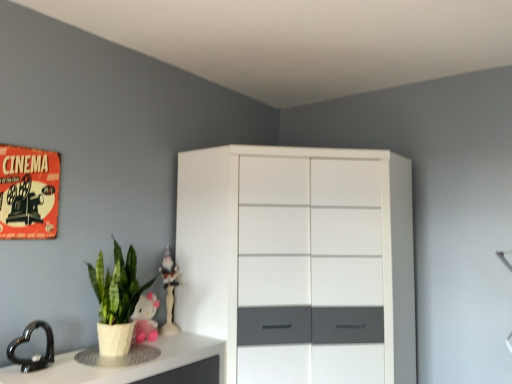
Question: Is pink plush toy at lower left, the 2th toy viewed from the back, bigger than white glossy counter top at lower left?

Choices:
 (A) no
 (B) yes

Answer: (A)

Question: From a real-world perspective, is pink plush toy at lower left, marked as the 1th toy in a front-to-back arrangement, on top of white glossy counter top at lower left?

Choices:
 (A) yes
 (B) no

Answer: (A)

Question: Is pink plush toy at lower left, the 2th toy viewed from the back, closer to camera compared to white glossy counter top at lower left?

Choices:
 (A) yes
 (B) no

Answer: (B)

Question: Does pink plush toy at lower left, the 2th toy viewed from the back, have a lesser width compared to white glossy counter top at lower left?

Choices:
 (A) yes
 (B) no

Answer: (A)

Question: Can you confirm if pink plush toy at lower left, marked as the 1th toy in a front-to-back arrangement, is positioned to the right of white glossy counter top at lower left?

Choices:
 (A) yes
 (B) no

Answer: (A)

Question: Does point (165, 301) appear closer or farther from the camera than point (335, 246)?

Choices:
 (A) farther
 (B) closer

Answer: (A)

Question: From a real-world perspective, relative to white glossy cabinet at center, is white glossy figurine at upper center, which is counted as the 2th toy, starting from the front, vertically above or below?

Choices:
 (A) below
 (B) above

Answer: (B)

Question: In the image, is white glossy figurine at upper center, the 1th toy positioned from the back, on the left side or the right side of white glossy cabinet at center?

Choices:
 (A) left
 (B) right

Answer: (A)

Question: From the image's perspective, is white glossy figurine at upper center, which is counted as the 2th toy, starting from the front, located above or below white glossy cabinet at center?

Choices:
 (A) below
 (B) above

Answer: (B)

Question: Considering the positions of point (152, 314) and point (169, 299), is point (152, 314) closer or farther from the camera than point (169, 299)?

Choices:
 (A) farther
 (B) closer

Answer: (B)

Question: From a real-world perspective, is pink plush toy at lower left, the 2th toy viewed from the back, positioned above or below white glossy figurine at upper center, which is counted as the 2th toy, starting from the front?

Choices:
 (A) below
 (B) above

Answer: (A)

Question: In the image, is pink plush toy at lower left, the 2th toy viewed from the back, on the left side or the right side of white glossy figurine at upper center, the 1th toy positioned from the back?

Choices:
 (A) right
 (B) left

Answer: (B)

Question: Is pink plush toy at lower left, the 2th toy viewed from the back, inside the boundaries of white glossy figurine at upper center, which is counted as the 2th toy, starting from the front, or outside?

Choices:
 (A) outside
 (B) inside

Answer: (A)

Question: From the image's perspective, is black glossy heart at lower left located above or below white glossy figurine at upper center, which is counted as the 2th toy, starting from the front?

Choices:
 (A) below
 (B) above

Answer: (A)

Question: Is black glossy heart at lower left situated inside white glossy figurine at upper center, which is counted as the 2th toy, starting from the front, or outside?

Choices:
 (A) outside
 (B) inside

Answer: (A)